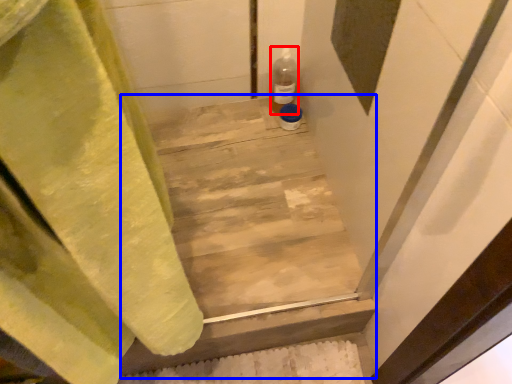
Question: Which object is closer to the camera taking this photo, bottle (highlighted by a red box) or stairwell (highlighted by a blue box)?

Choices:
 (A) bottle
 (B) stairwell

Answer: (B)